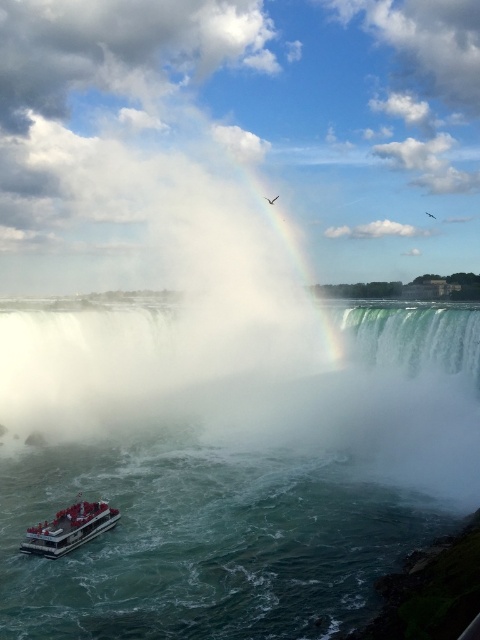
You are standing at the observation deck near the base of Niagara Falls. There is a point marked at coordinates point (166, 492) that you want to reach. If your camera is 1.5 meters tall, can you safely walk to that point without getting wet?

The point (166, 492) is 19.05 meters away from the camera. Since the distance is quite far and the water around the boat is turbulent, it might be dangerous to walk there. However, the exact safety cannot be determined without additional information about the path and water conditions.

You are a tourist standing on the observation deck and see the clear water at lower left and the white plastic boat at lower left. Which one takes up more space in the image?

The clear water at lower left takes up more space in the image because it is bigger than the white plastic boat at lower left.